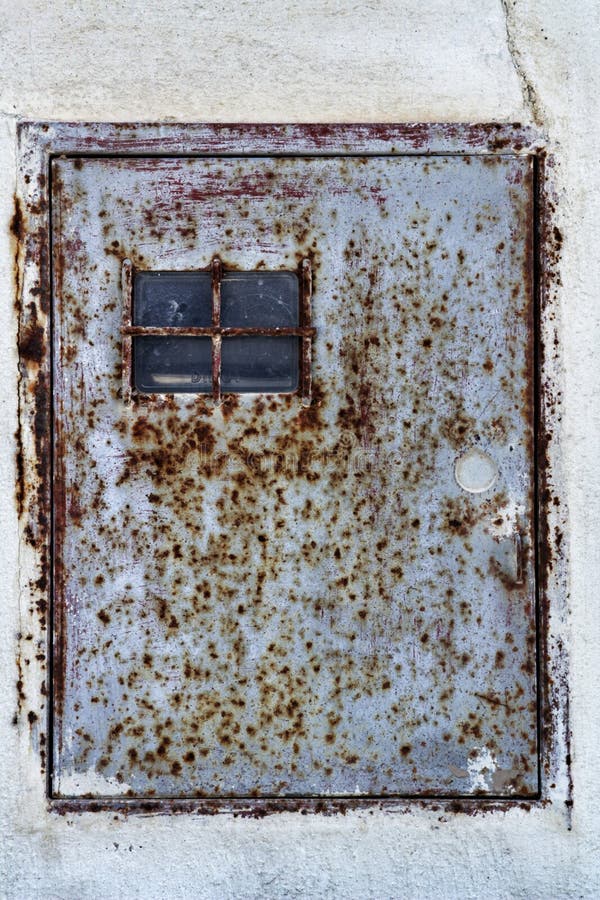
Find the location of a particular element. door edge on right is located at coordinates (533, 265).